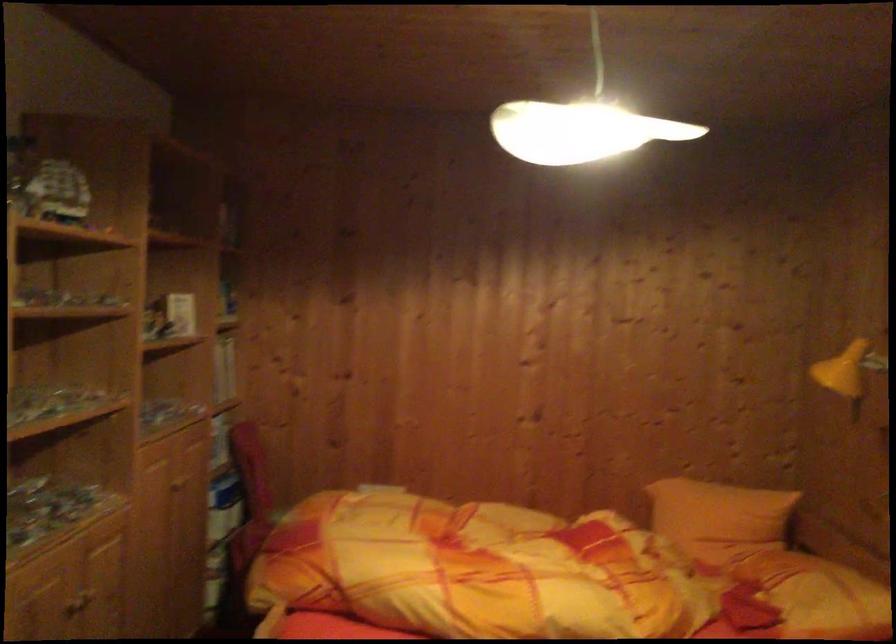
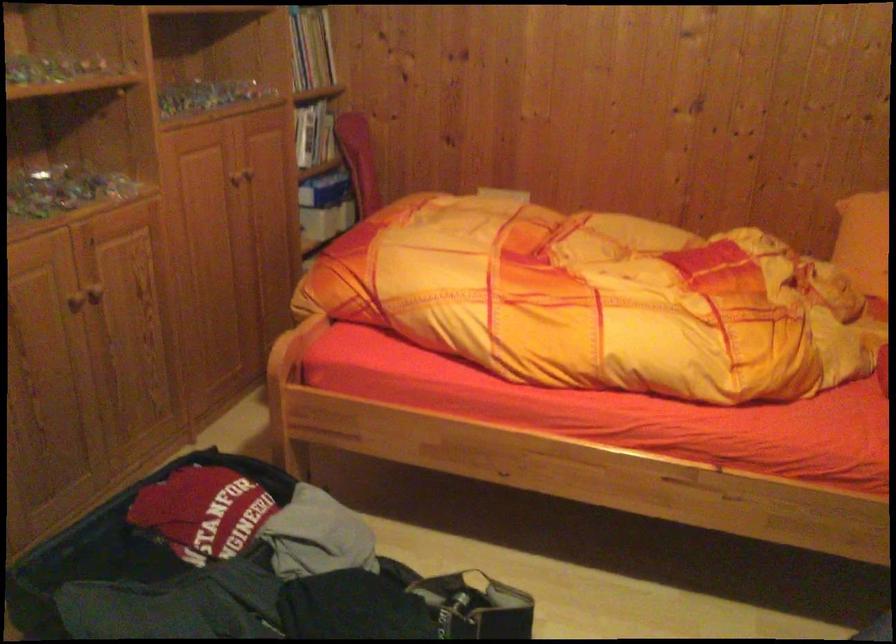
What movement of the cameraman would produce the second image?

The movement direction of the cameraman is right, forward.